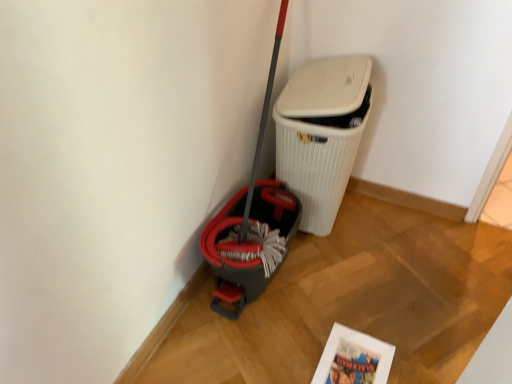
Question: Is white textured waste bin at center further to camera compared to matte white comic book at lower center?

Choices:
 (A) yes
 (B) no

Answer: (A)

Question: From the image's perspective, is white textured waste bin at center located beneath matte white comic book at lower center?

Choices:
 (A) yes
 (B) no

Answer: (B)

Question: Can you confirm if white textured waste bin at center is positioned to the left of matte white comic book at lower center?

Choices:
 (A) no
 (B) yes

Answer: (B)

Question: Is the depth of white textured waste bin at center less than that of matte white comic book at lower center?

Choices:
 (A) yes
 (B) no

Answer: (B)

Question: From a real-world perspective, is white textured waste bin at center under matte white comic book at lower center?

Choices:
 (A) yes
 (B) no

Answer: (B)

Question: Considering the relative sizes of white textured waste bin at center and matte white comic book at lower center in the image provided, is white textured waste bin at center shorter than matte white comic book at lower center?

Choices:
 (A) yes
 (B) no

Answer: (B)

Question: From a real-world perspective, is matte white comic book at lower center under white textured waste bin at center?

Choices:
 (A) no
 (B) yes

Answer: (B)

Question: Considering the relative sizes of matte white comic book at lower center and white textured waste bin at center in the image provided, is matte white comic book at lower center shorter than white textured waste bin at center?

Choices:
 (A) yes
 (B) no

Answer: (A)

Question: Is matte white comic book at lower center next to white textured waste bin at center?

Choices:
 (A) yes
 (B) no

Answer: (B)

Question: Is matte white comic book at lower center to the right of white textured waste bin at center from the viewer's perspective?

Choices:
 (A) no
 (B) yes

Answer: (B)

Question: Could white textured waste bin at center be considered to be inside matte white comic book at lower center?

Choices:
 (A) no
 (B) yes

Answer: (A)

Question: Can you confirm if matte white comic book at lower center is positioned to the left of white textured waste bin at center?

Choices:
 (A) yes
 (B) no

Answer: (B)

Question: In terms of height, does matte white comic book at lower center look taller or shorter compared to white textured waste bin at center?

Choices:
 (A) short
 (B) tall

Answer: (A)